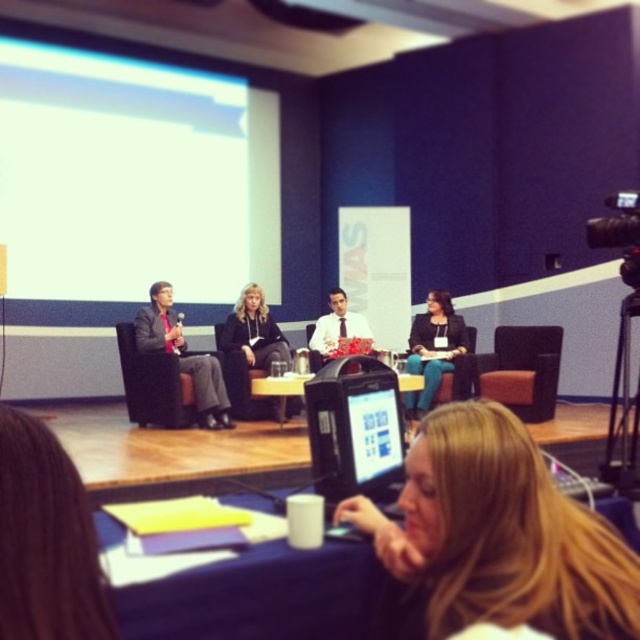
Between blonde hair at lower right and wooden table at center, which one is positioned higher?

Positioned higher is blonde hair at lower right.

Locate an element on the screen. The image size is (640, 640). blonde hair at lower right is located at coordinates (45, 540).

Find the location of a particular element. The image size is (640, 640). blonde hair at lower right is located at coordinates (45, 540).

Which is more to the right, blue fabric table at lower center or brown fabric chair at center?

From the viewer's perspective, brown fabric chair at center appears more on the right side.

Who is lower down, blue fabric table at lower center or brown fabric chair at center?

Positioned lower is blue fabric table at lower center.

Which is behind, point (253, 580) or point (481, 380)?

The point (481, 380) is behind.

Find the location of a particular element. blue fabric table at lower center is located at coordinates (260, 595).

Does blue fabric table at lower center appear on the right side of black fleece jacket at center?

Yes, blue fabric table at lower center is to the right of black fleece jacket at center.

Does blue fabric table at lower center appear over black fleece jacket at center?

Actually, blue fabric table at lower center is below black fleece jacket at center.

This screenshot has height=640, width=640. Find the location of `blue fabric table at lower center`. blue fabric table at lower center is located at coordinates (260, 595).

This screenshot has height=640, width=640. Find the location of `blue fabric table at lower center`. blue fabric table at lower center is located at coordinates (260, 595).